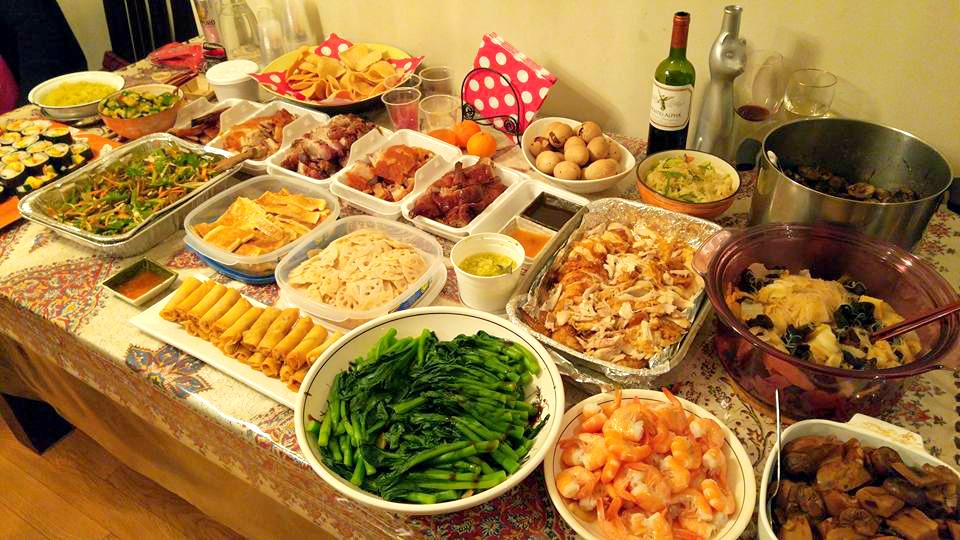
Locate an element on the screen. The width and height of the screenshot is (960, 540). wine bottle is located at coordinates click(x=669, y=107).